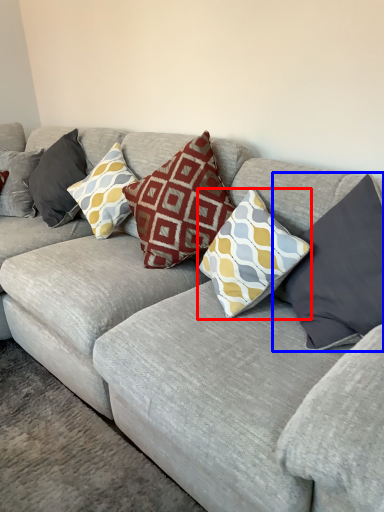
Question: Which object appears farthest to the camera in this image, pillow (highlighted by a red box) or pillow (highlighted by a blue box)?

Choices:
 (A) pillow
 (B) pillow

Answer: (A)